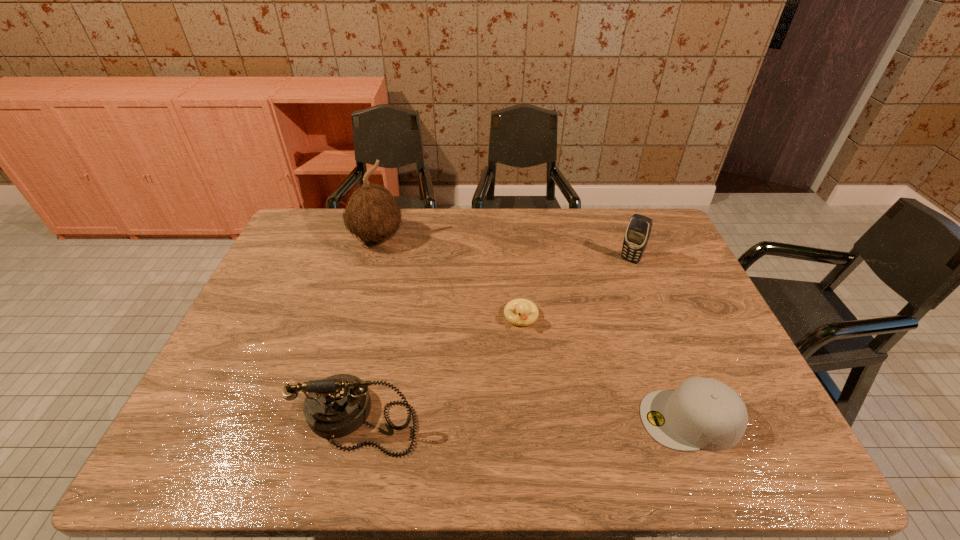
Locate an element on the screen. empty space that is in between the telephone and the third object from right to left is located at coordinates (441, 368).

At what (x,y) coordinates should I click in order to perform the action: click on blank region between the shortest object and the coconut. Please return your answer as a coordinate pair (x, y). The width and height of the screenshot is (960, 540). Looking at the image, I should click on (449, 278).

Find the location of a particular element. object that stands as the closest to the tallest object is located at coordinates (527, 312).

This screenshot has height=540, width=960. I want to click on the fourth closest object to the second shortest object, so click(371, 213).

Find the location of a particular element. free location that satisfies the following two spatial constraints: 1. on the front side of the tallest object; 2. on the front-facing side of the cap is located at coordinates (325, 420).

Where is `free point that satisfies the following two spatial constraints: 1. on the back side of the duckling; 2. on the left side of the telephone`? free point that satisfies the following two spatial constraints: 1. on the back side of the duckling; 2. on the left side of the telephone is located at coordinates (382, 317).

Locate an element on the screen. The height and width of the screenshot is (540, 960). vacant space that satisfies the following two spatial constraints: 1. on the front side of the duckling; 2. on the left side of the tallest object is located at coordinates (355, 317).

The image size is (960, 540). In order to click on blank space that satisfies the following two spatial constraints: 1. on the back side of the cellular telephone; 2. on the left side of the telephone in this screenshot , I will do `click(395, 260)`.